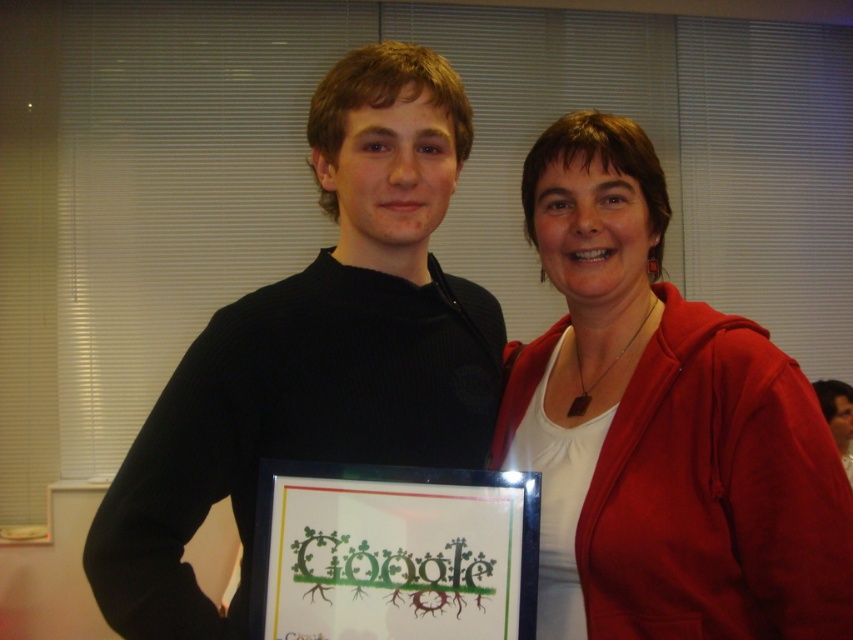
Does black ribbed sweater at center appear on the right side of black framed picture at center?

No, black ribbed sweater at center is not to the right of black framed picture at center.

Find the location of a particular element. black ribbed sweater at center is located at coordinates (315, 352).

Identify the location of black ribbed sweater at center. (315, 352).

Between white matte shirt at center and black framed picture at center, which one is positioned lower?

black framed picture at center is lower down.

Consider the image. Who is more forward, (x=703, y=438) or (x=386, y=557)?

Point (x=386, y=557) is in front.

Is point (709, 408) behind point (444, 476)?

Yes, it is.

This screenshot has width=853, height=640. I want to click on white matte shirt at center, so click(x=660, y=426).

Does point (680, 628) come in front of point (485, 419)?

That is True.

What are the coordinates of `white matte shirt at center` in the screenshot? It's located at (660, 426).

Where is `white matte shirt at center`? The width and height of the screenshot is (853, 640). white matte shirt at center is located at coordinates (660, 426).

The height and width of the screenshot is (640, 853). In order to click on white matte shirt at center in this screenshot , I will do `click(660, 426)`.